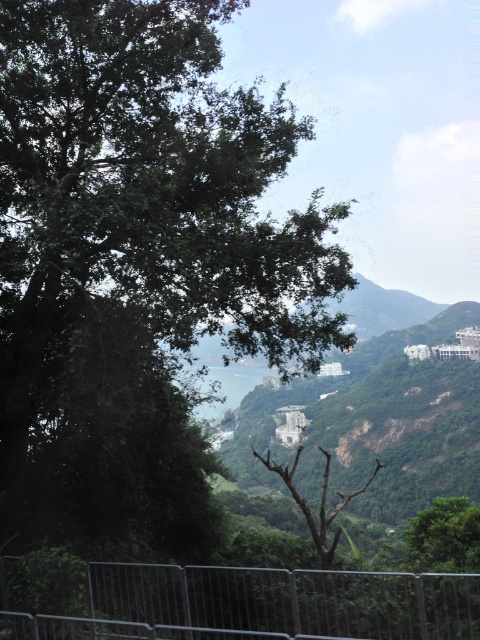
Question: Is metallic silver fence at lower center smaller than brown dry wood at center?

Choices:
 (A) no
 (B) yes

Answer: (B)

Question: Which point is farther to the camera?

Choices:
 (A) (418, 595)
 (B) (183, 445)
 (C) (326, 460)

Answer: (C)

Question: Observing the image, what is the correct spatial positioning of metallic silver fence at lower center in reference to brown dry wood at center?

Choices:
 (A) right
 (B) left

Answer: (B)

Question: Which object is the closest to the brown dry wood at center?

Choices:
 (A) green leafy tree at upper left
 (B) metallic silver fence at lower center

Answer: (A)

Question: Which of the following is the closest to the observer?

Choices:
 (A) (327, 625)
 (B) (131, 161)

Answer: (A)

Question: Is metallic silver fence at lower center bigger than brown dry wood at center?

Choices:
 (A) yes
 (B) no

Answer: (B)